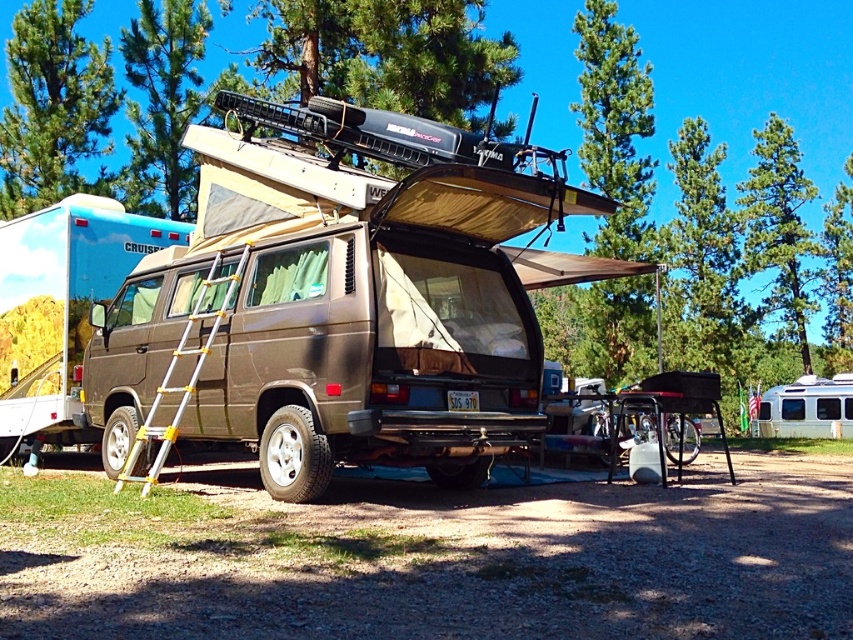
The height and width of the screenshot is (640, 853). Describe the element at coordinates (61, 301) in the screenshot. I see `brown matte van at center` at that location.

Can you confirm if brown matte van at center is bigger than yellow aluminum ladder at side?

Indeed, brown matte van at center has a larger size compared to yellow aluminum ladder at side.

Between point (10, 400) and point (215, 328), which one is positioned in front?

Positioned in front is point (215, 328).

Find the location of a particular element. Image resolution: width=853 pixels, height=640 pixels. brown matte van at center is located at coordinates (61, 301).